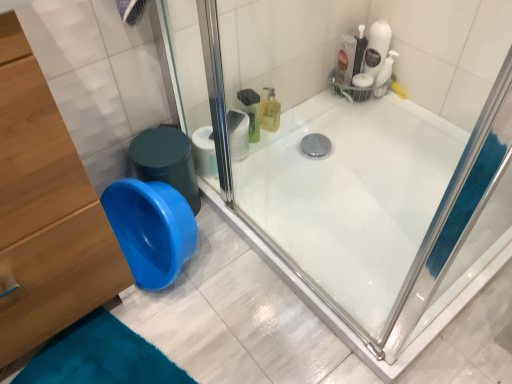
Question: From the image's perspective, is wooden dresser at left positioned above or below blue plastic potty at lower left?

Choices:
 (A) above
 (B) below

Answer: (B)

Question: From a real-world perspective, is wooden dresser at left physically located above or below blue plastic potty at lower left?

Choices:
 (A) above
 (B) below

Answer: (A)

Question: Estimate the real-world distances between objects in this image. Which object is closer to the blue plastic potty at lower left?

Choices:
 (A) wooden dresser at left
 (B) white matte toilet paper at upper center

Answer: (B)

Question: Considering the real-world distances, which object is closest to the blue plastic potty at lower left?

Choices:
 (A) wooden dresser at left
 (B) white matte toilet paper at upper center

Answer: (B)